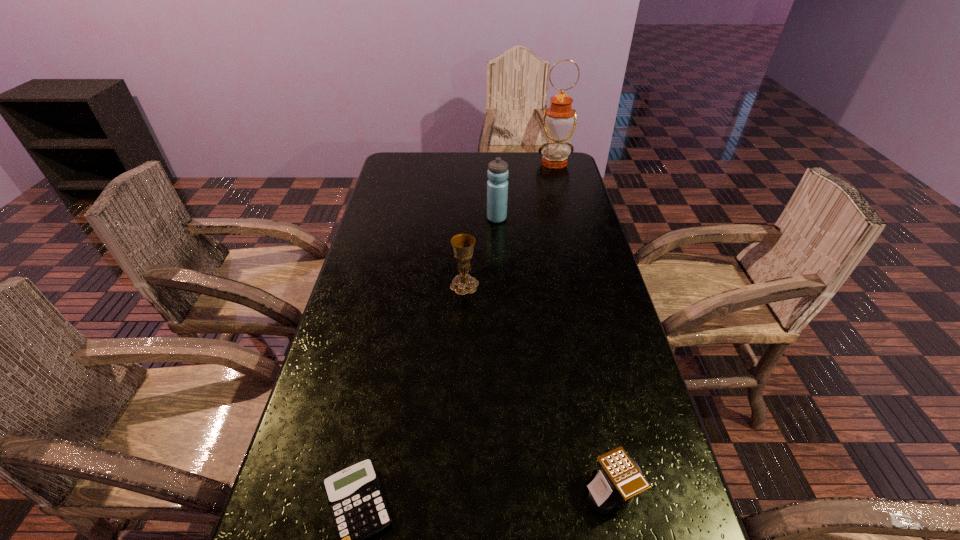
This screenshot has height=540, width=960. What are the coordinates of `unoccupied position between the tallest object and the taller calculator` in the screenshot? It's located at (583, 327).

Identify the location of free point between the third nearest object and the right calculator. (538, 388).

Locate an element on the screen. This screenshot has height=540, width=960. vacant space that's between the fourth object from right to left and the right calculator is located at coordinates (538, 388).

Locate an element on the screen. free spot between the taller calculator and the water bottle is located at coordinates (554, 354).

You are a GUI agent. You are given a task and a screenshot of the screen. Output one action in this format:
    pyautogui.click(x=<x>, y=<y>)
    Task: Click on the object that ranks as the third closest to the right calculator
    The image size is (960, 540).
    Given the screenshot: What is the action you would take?
    pyautogui.click(x=497, y=186)

Where is `object that can be found as the second closest to the left calculator`? The image size is (960, 540). object that can be found as the second closest to the left calculator is located at coordinates (463, 244).

I want to click on vacant space that satisfies the following two spatial constraints: 1. on the back side of the chalice; 2. on the left side of the third object from right to left, so click(x=467, y=218).

Image resolution: width=960 pixels, height=540 pixels. I want to click on vacant region that satisfies the following two spatial constraints: 1. on the back side of the farthest object; 2. on the right side of the chalice, so click(469, 163).

The image size is (960, 540). Identify the location of free space that satisfies the following two spatial constraints: 1. on the front side of the fourth shortest object; 2. on the left side of the second shortest object. (510, 490).